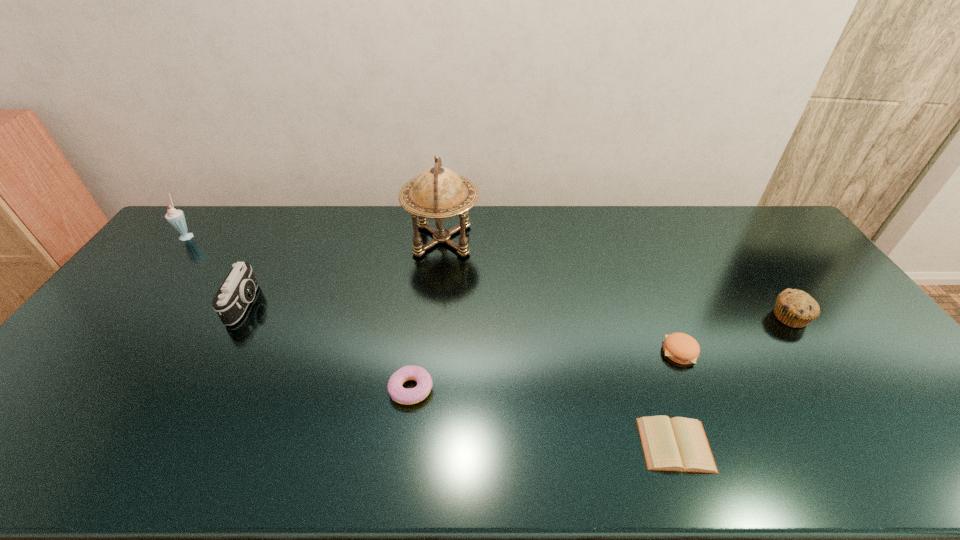
At what (x,y) coordinates should I click in order to perform the action: click on vacant position in the image that satisfies the following two spatial constraints: 1. on the front-facing side of the fifth farthest object; 2. on the right side of the tallest object. Please return your answer as a coordinate pair (x, y). Looking at the image, I should click on (431, 352).

Identify the location of free space in the image that satisfies the following two spatial constraints: 1. on the front lens of the second object from left to right; 2. on the right side of the fifth farthest object. (220, 352).

This screenshot has height=540, width=960. Find the location of `blank space that satisfies the following two spatial constraints: 1. on the straw side of the sixth farthest object; 2. on the left side of the milkshake`. blank space that satisfies the following two spatial constraints: 1. on the straw side of the sixth farthest object; 2. on the left side of the milkshake is located at coordinates (66, 389).